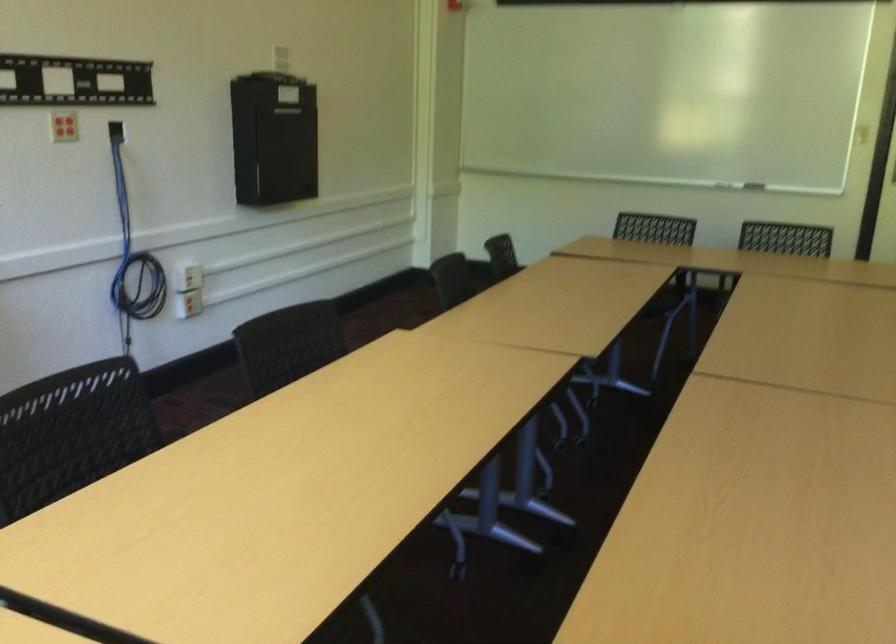
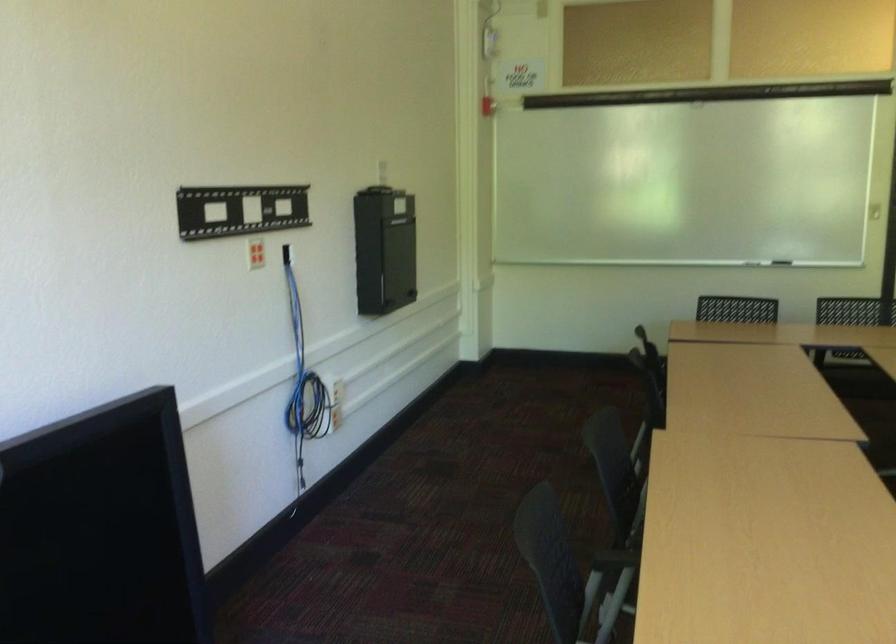
Question: In a continuous first-person perspective shot, in which direction is the camera moving?

Choices:
 (A) Left
 (B) Right
 (C) Forward
 (D) Backward

Answer: (A)